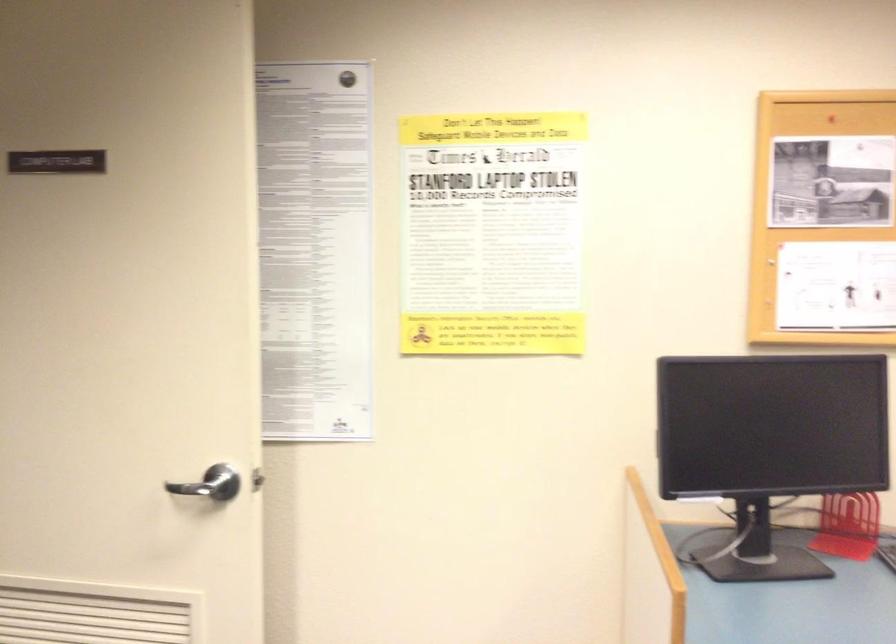
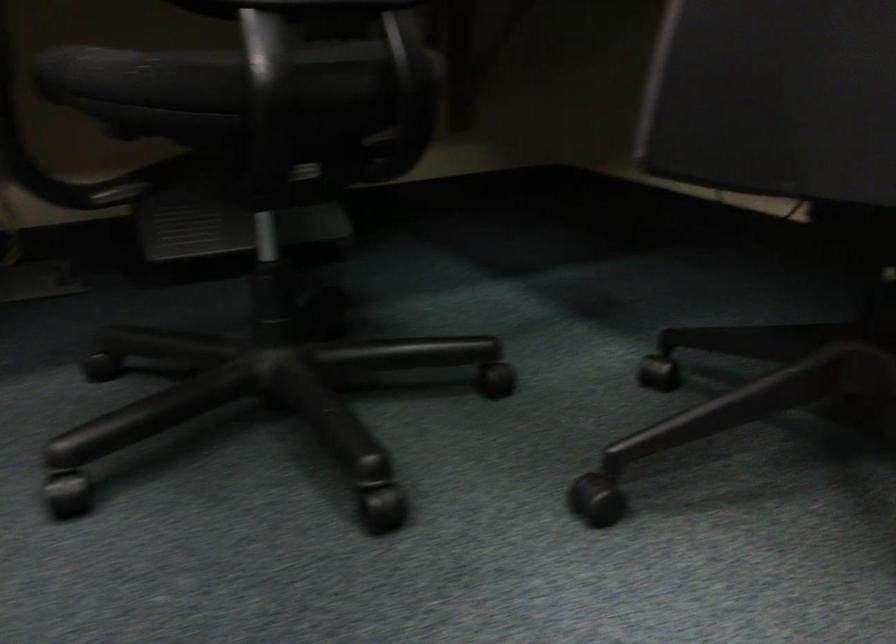
How did the camera likely rotate?

The rotation direction of the camera is right-down.